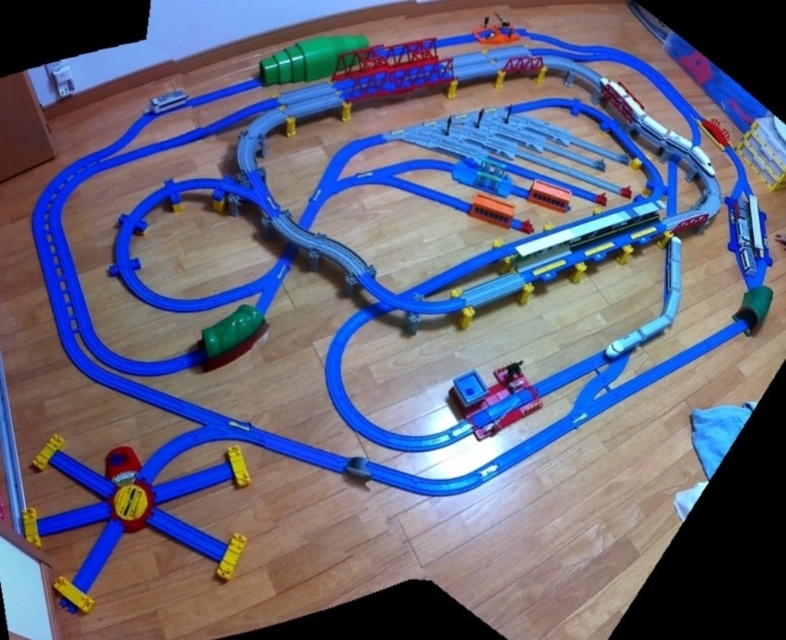
Is translucent plastic train at center bigger than metallic blue train at right?

No.

Consider the image. Between translucent plastic train at center and metallic blue train at right, which one has more height?

Standing taller between the two is metallic blue train at right.

From the picture: Who is more distant from viewer, [465,406] or [744,220]?

Point [744,220]

At what (x,y) coordinates should I click in order to perform the action: click on translucent plastic train at center. Please return your answer as a coordinate pair (x, y). Image resolution: width=786 pixels, height=640 pixels. Looking at the image, I should click on (493, 396).

Does point (518, 364) come farther from viewer compared to point (230, 468)?

Yes.

Who is more forward, (513, 381) or (237, 452)?

Point (237, 452) is in front.

The width and height of the screenshot is (786, 640). Find the location of `translucent plastic train at center`. translucent plastic train at center is located at coordinates (493, 396).

Is shiny metallic train at upper right below yellow plastic track at bottom left?

No.

The image size is (786, 640). In order to click on shiny metallic train at upper right in this screenshot , I will do `click(766, 148)`.

Measure the distance between shiny metallic train at upper right and camera.

They are 7.21 feet apart.

The image size is (786, 640). Find the location of `shiny metallic train at upper right`. shiny metallic train at upper right is located at coordinates (766, 148).